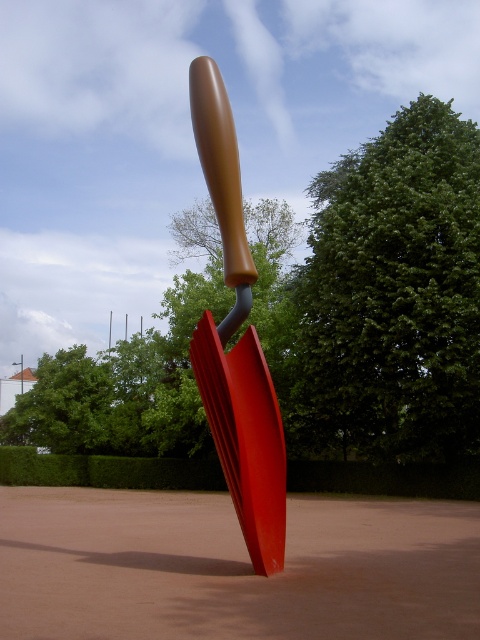
You are an artist analyzing the sculpture and its surroundings. You notice the green leafy tree at upper center and the matte brown handle at center. Which object is located to the right of the other?

The green leafy tree at upper center is positioned on the right side of matte brown handle at center.

You are an artist planning to paint this sculpture scene. You need to decide which object should be placed higher in your painting to maintain the scene proportions. Which one should be higher, the green leafy tree at upper center or the matte brown handle at center?

The green leafy tree at upper center should be placed higher in the painting because it has a greater height compared to the matte brown handle at center.